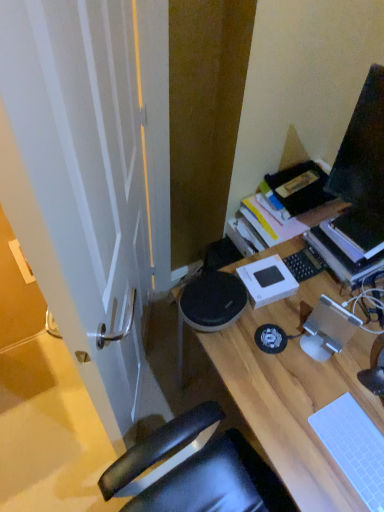
Question: Is point coord(327,404) closer or farther from the camera than point coord(291,386)?

Choices:
 (A) closer
 (B) farther

Answer: (A)

Question: Based on their sizes in the image, would you say white matte laptop keyboard at lower right, the second laptop keyboard when ordered from back to front, is bigger or smaller than wooden desk at center?

Choices:
 (A) big
 (B) small

Answer: (B)

Question: Estimate the real-world distances between objects in this image. Which object is farther from the wooden desk at center?

Choices:
 (A) hardcover book at upper right
 (B) white matte laptop keyboard at lower right, the second laptop keyboard when ordered from back to front
 (C) black matte laptop keyboard at center-right, the 2th laptop keyboard when ordered from front to back

Answer: (A)

Question: Which object is positioned closest to the black matte laptop keyboard at center-right, placed as the 1th laptop keyboard when sorted from back to front?

Choices:
 (A) wooden desk at center
 (B) hardcover book at upper right
 (C) white matte laptop keyboard at lower right, the second laptop keyboard when ordered from back to front

Answer: (B)